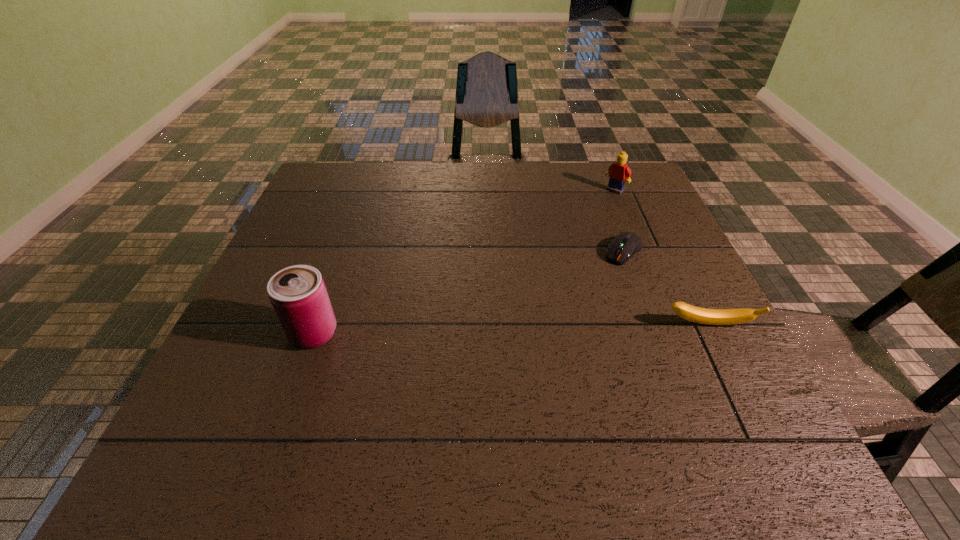
Image resolution: width=960 pixels, height=540 pixels. I want to click on object that is at the far right corner, so click(618, 171).

Locate an element on the screen. vacant space at the far edge of the desktop is located at coordinates (585, 187).

Identify the location of vacant space at the near edge of the desktop. (593, 381).

Locate an element on the screen. This screenshot has height=540, width=960. free location at the left edge of the desktop is located at coordinates (233, 343).

Identify the location of vacant space at the right edge. The width and height of the screenshot is (960, 540). (619, 215).

In the image, there is a desktop. Identify the location of vacant space at the far left corner. (315, 193).

Find the location of a particular element. free location at the near left corner is located at coordinates (281, 392).

Where is `vacant space at the far right corner of the desktop`? The image size is (960, 540). vacant space at the far right corner of the desktop is located at coordinates coord(627,185).

You are a GUI agent. You are given a task and a screenshot of the screen. Output one action in this format:
    pyautogui.click(x=<x>, y=<y>)
    Task: Click on the free area in between the third tallest object and the farthest object
    This screenshot has width=960, height=540.
    Given the screenshot: What is the action you would take?
    pyautogui.click(x=661, y=258)

Where is `free space between the third tallest object and the second farthest object`? This screenshot has height=540, width=960. free space between the third tallest object and the second farthest object is located at coordinates 666,288.